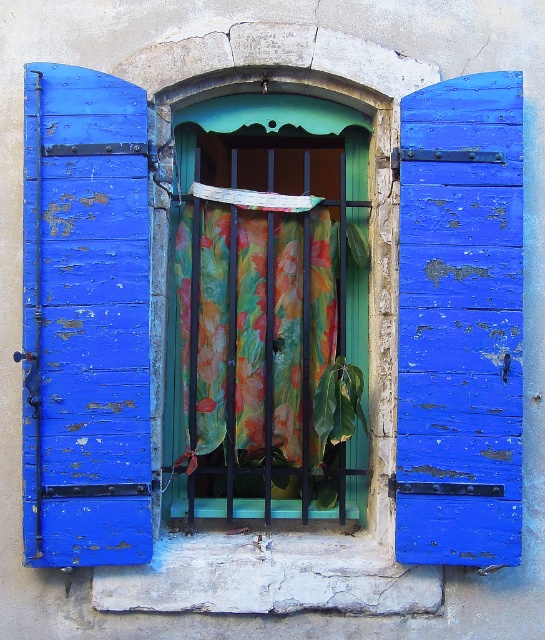
You are standing in a garden 5 meters away from the wall with the window. You want to touch the peeling blue wood at right. Can you reach it without moving closer?

The peeling blue wood at right is 4.14 meters away from the viewer. Since you are currently 5 meters away, you cannot reach it without moving closer.

You are an interior designer assessing the window decor. You need to determine which object, the peeling blue wood at right or the floral fabric at center, is taller. Based on the scene description, which one is taller?

The peeling blue wood at right has a greater height compared to floral fabric at center, so the peeling blue wood at right is taller.

Looking at this image, you are a painter who wants to place a 45 cm wide canvas between the peeling blue wood at right and the floral fabric at center. Can the canvas fit in the space between them?

The distance between the peeling blue wood at right and the floral fabric at center is 44.57 centimeters. Since the canvas is 45 cm wide, it is slightly wider than the available space. Therefore, the canvas cannot fit between them.